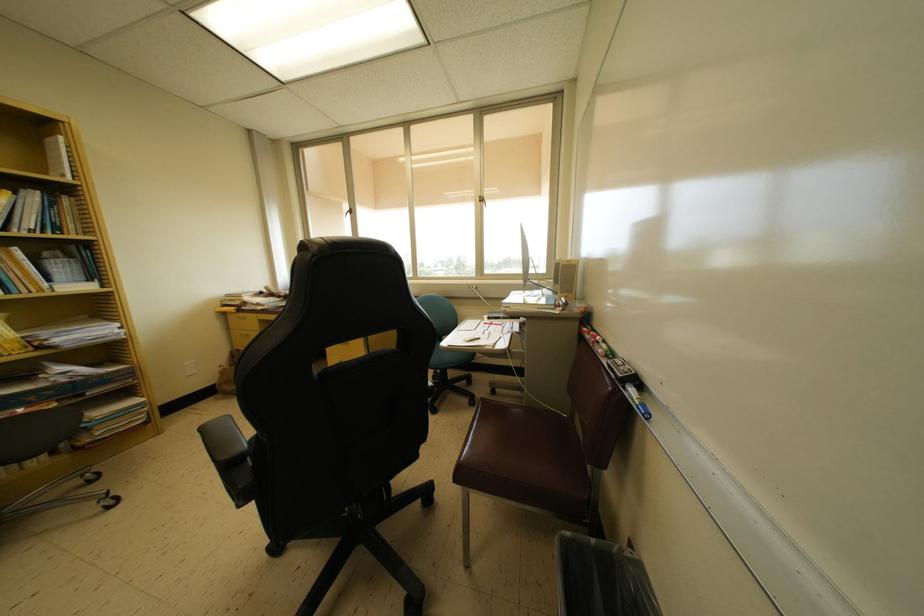
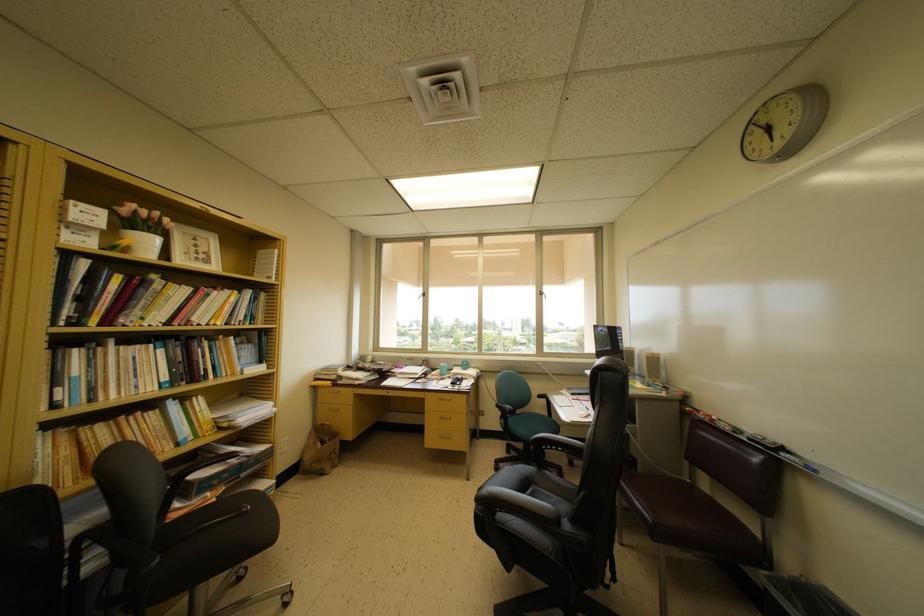
What movement of the cameraman would produce the second image?

The movement direction of the cameraman is left, backward.